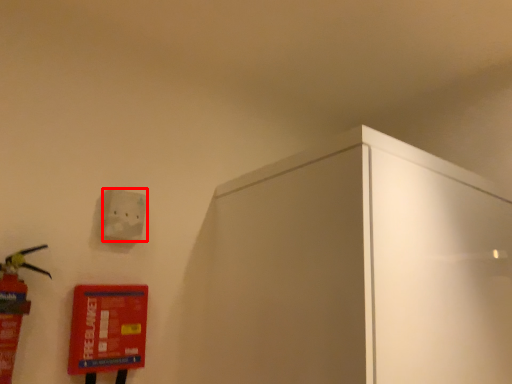
Question: From the image's perspective, where is light switch (annotated by the red box) located relative to extinguisher?

Choices:
 (A) below
 (B) above

Answer: (B)